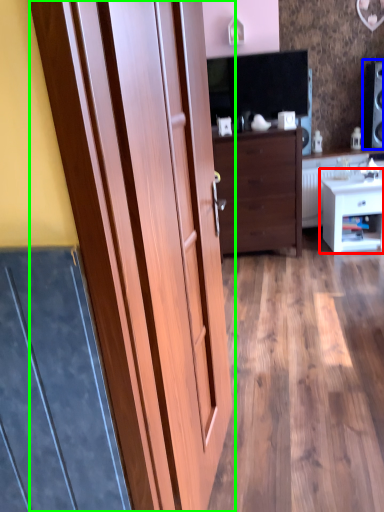
Question: Considering the real-world distances, which object is closest to nightstand (highlighted by a red box)? speaker (highlighted by a blue box) or door (highlighted by a green box).

Choices:
 (A) speaker
 (B) door

Answer: (A)